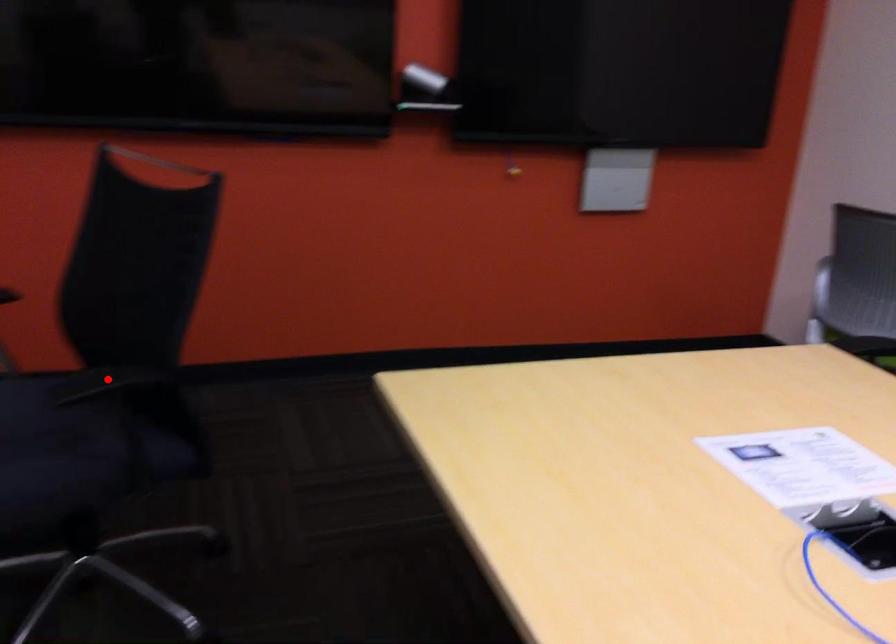
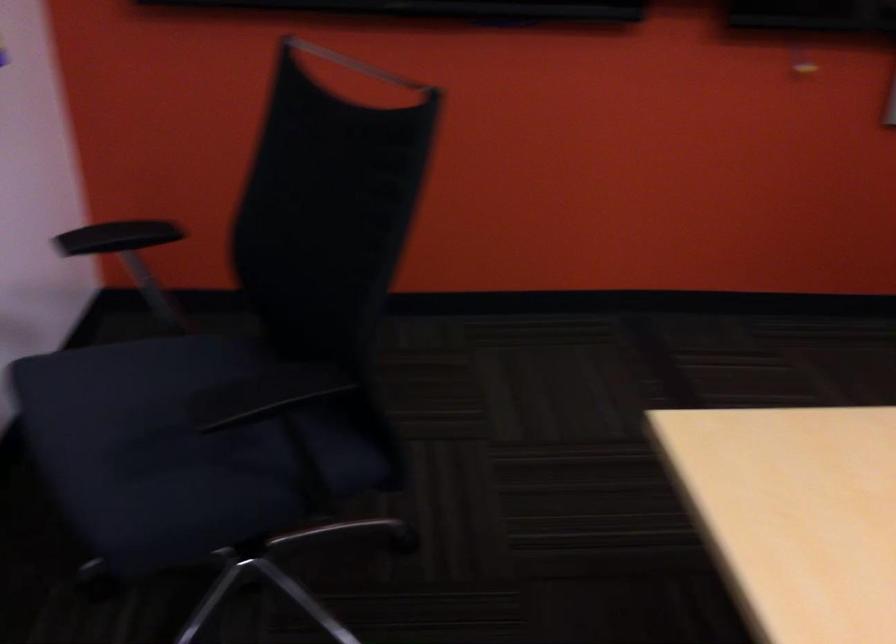
In the second image, find the point that corresponds to the highlighted location in the first image.

(264, 395)